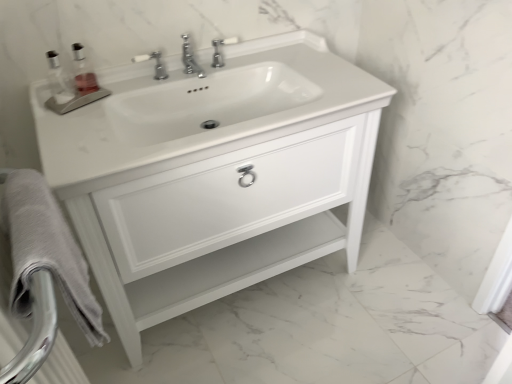
This screenshot has height=384, width=512. What do you see at coordinates (190, 59) in the screenshot? I see `chrome metallic faucet at center` at bounding box center [190, 59].

Describe the element at coordinates (199, 111) in the screenshot. This screenshot has width=512, height=384. I see `white glossy sink at center` at that location.

Find the location of a particular element. gray cotton bath towel at lower left is located at coordinates (46, 250).

From the image's perspective, does clear glass soap dispenser at upper left appear lower than chrome metallic faucet at center?

Yes.

Considering the relative sizes of clear glass soap dispenser at upper left and chrome metallic faucet at center in the image provided, is clear glass soap dispenser at upper left taller than chrome metallic faucet at center?

Yes.

Is clear glass soap dispenser at upper left outside of chrome metallic faucet at center?

Yes.

Is chrome metallic faucet at center at the back of clear glass soap dispenser at upper left?

No.

Who is taller, white glossy sink at center or white glossy cabinet at center?

white glossy cabinet at center.

Is point (168, 143) behind point (72, 146)?

Yes, point (168, 143) is farther from viewer.

Image resolution: width=512 pixels, height=384 pixels. In order to click on bathroom cabinet lying on the right of gray cotton bath towel at lower left in this screenshot , I will do `click(213, 174)`.

Who is shorter, gray cotton bath towel at lower left or white glossy cabinet at center?

gray cotton bath towel at lower left.

Could white glossy cabinet at center be considered to be inside gray cotton bath towel at lower left?

No, white glossy cabinet at center is not surrounded by gray cotton bath towel at lower left.

From the image's perspective, which one is positioned higher, gray cotton bath towel at lower left or white glossy cabinet at center?

white glossy cabinet at center appears higher in the image.

Is chrome metallic faucet at center not near clear glass soap dispenser at upper left?

chrome metallic faucet at center is near clear glass soap dispenser at upper left, not far away.

From the image's perspective, is chrome metallic faucet at center below clear glass soap dispenser at upper left?

Incorrect, from the image's perspective, chrome metallic faucet at center is higher than clear glass soap dispenser at upper left.

How many degrees apart are the facing directions of chrome metallic faucet at center and clear glass soap dispenser at upper left?

chrome metallic faucet at center and clear glass soap dispenser at upper left are facing 24.2 degrees away from each other.

Does chrome metallic faucet at center have a lesser height compared to clear glass soap dispenser at upper left?

Yes, chrome metallic faucet at center is shorter than clear glass soap dispenser at upper left.

At what (x,y) coordinates should I click in order to perform the action: click on soap dispenser above the white glossy sink at center (from the image's perspective). Please return your answer as a coordinate pair (x, y). Looking at the image, I should click on (83, 72).

Looking at their sizes, would you say clear glass soap dispenser at upper left is wider or thinner than white glossy sink at center?

In the image, clear glass soap dispenser at upper left appears to be more narrow than white glossy sink at center.

Can you confirm if clear glass soap dispenser at upper left is bigger than white glossy sink at center?

Actually, clear glass soap dispenser at upper left might be smaller than white glossy sink at center.

From the image's perspective, is chrome metallic faucet at center on white glossy sink at center?

Yes.

Between chrome metallic faucet at center and white glossy sink at center, which one has less height?

Standing shorter between the two is chrome metallic faucet at center.

How distant is chrome metallic faucet at center from white glossy sink at center?

chrome metallic faucet at center is 13.64 inches from white glossy sink at center.

Would you say chrome metallic faucet at center contains white glossy sink at center?

No, chrome metallic faucet at center does not contain white glossy sink at center.

How distant is white glossy sink at center from clear glass soap dispenser at upper left?

white glossy sink at center and clear glass soap dispenser at upper left are 43.44 centimeters apart.

Is there a large distance between white glossy sink at center and clear glass soap dispenser at upper left?

Actually, white glossy sink at center and clear glass soap dispenser at upper left are a little close together.

From the image's perspective, does white glossy sink at center appear higher than clear glass soap dispenser at upper left?

Actually, white glossy sink at center appears below clear glass soap dispenser at upper left in the image.

Locate an element on the screen. This screenshot has width=512, height=384. sink in front of the clear glass soap dispenser at upper left is located at coordinates (199, 111).

Where is `soap dispenser that is in front of the chrome metallic faucet at center`? This screenshot has width=512, height=384. soap dispenser that is in front of the chrome metallic faucet at center is located at coordinates (83, 72).

Image resolution: width=512 pixels, height=384 pixels. Identify the location of bathroom cabinet behind the white glossy sink at center. (213, 174).

When comparing their distances from chrome metallic faucet at center, does white glossy sink at center or clear glass soap dispenser at upper left seem further?

white glossy sink at center lies further to chrome metallic faucet at center than the other object.

When comparing their distances from white glossy sink at center, does chrome metallic faucet at center or clear glass soap dispenser at upper left seem further?

The object further to white glossy sink at center is clear glass soap dispenser at upper left.

From the image, which object appears to be nearer to white glossy sink at center, white glossy cabinet at center or chrome metallic faucet at center?

Among the two, white glossy cabinet at center is located nearer to white glossy sink at center.

Considering their positions, is white glossy cabinet at center positioned closer to clear glass soap dispenser at upper left than gray cotton bath towel at lower left?

white glossy cabinet at center lies closer to clear glass soap dispenser at upper left than the other object.

When comparing their distances from chrome metallic faucet at center, does clear glass soap dispenser at upper left or gray cotton bath towel at lower left seem further?

gray cotton bath towel at lower left lies further to chrome metallic faucet at center than the other object.

Consider the image. When comparing their distances from chrome metallic faucet at center, does clear glass soap dispenser at upper left or white glossy sink at center seem closer?

clear glass soap dispenser at upper left is closer to chrome metallic faucet at center.

When comparing their distances from chrome metallic faucet at center, does white glossy sink at center or white glossy cabinet at center seem further?

white glossy cabinet at center.

From the image, which object appears to be farther from chrome metallic faucet at center, gray cotton bath towel at lower left or white glossy sink at center?

The object further to chrome metallic faucet at center is gray cotton bath towel at lower left.

Locate an element on the screen. This screenshot has width=512, height=384. sink situated between clear glass soap dispenser at upper left and white glossy cabinet at center from left to right is located at coordinates (199, 111).

At what (x,y) coordinates should I click in order to perform the action: click on sink between gray cotton bath towel at lower left and clear glass soap dispenser at upper left from front to back. Please return your answer as a coordinate pair (x, y). The image size is (512, 384). Looking at the image, I should click on (199, 111).

Identify the location of sink between chrome metallic faucet at center and white glossy cabinet at center in the vertical direction. (199, 111).

Find the location of a particular element. Image resolution: width=512 pixels, height=384 pixels. sink between gray cotton bath towel at lower left and chrome metallic faucet at center along the z-axis is located at coordinates (199, 111).